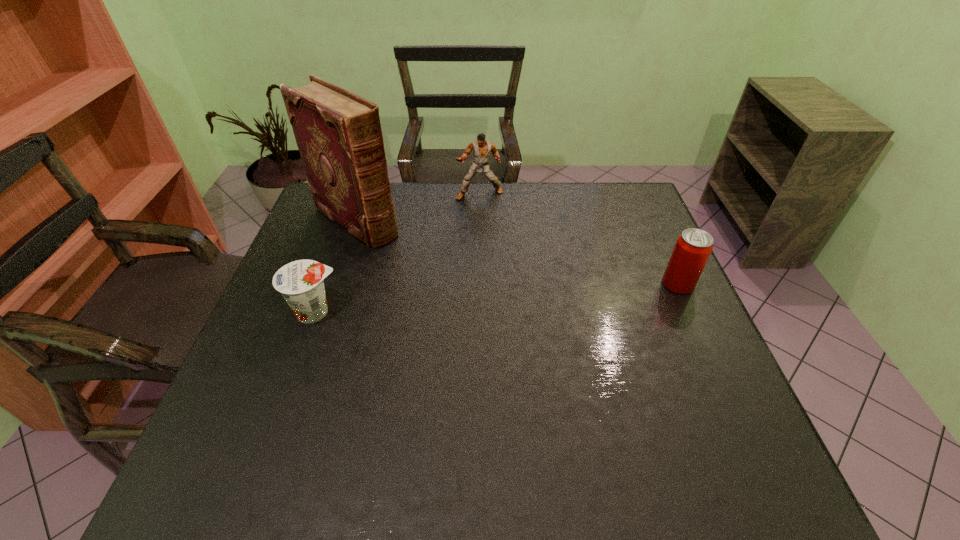
The image size is (960, 540). Identify the location of free region located on the front-facing side of the second tallest object. (485, 235).

The image size is (960, 540). I want to click on vacant space positioned on the spine side of the hardback book, so click(470, 299).

Identify the location of vacant region located 0.390m on the spine side of the hardback book. (482, 307).

Where is `free location located on the spine side of the hardback book`? Image resolution: width=960 pixels, height=540 pixels. free location located on the spine side of the hardback book is located at coordinates (476, 303).

What are the coordinates of `puncher that is at the far edge` in the screenshot? It's located at (482, 149).

The image size is (960, 540). What are the coordinates of `hardback book located at the far edge` in the screenshot? It's located at (339, 136).

Where is `yogurt at the left edge`? The height and width of the screenshot is (540, 960). yogurt at the left edge is located at coordinates (300, 282).

Find the location of a particular element. Image resolution: width=960 pixels, height=540 pixels. hardback book that is at the left edge is located at coordinates (339, 136).

You are a GUI agent. You are given a task and a screenshot of the screen. Output one action in this format:
    pyautogui.click(x=<x>, y=<y>)
    Task: Click on the object located in the right edge section of the desktop
    
    Given the screenshot: What is the action you would take?
    pyautogui.click(x=693, y=247)

At what (x,y) coordinates should I click in order to perform the action: click on object at the far left corner. Please return your answer as a coordinate pair (x, y). Looking at the image, I should click on (339, 136).